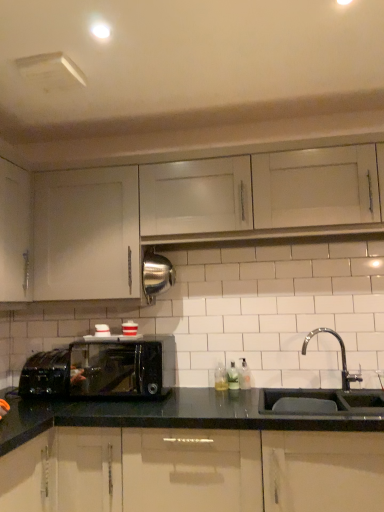
Question: Does black matte sink at lower right lie behind clear glass soap dispenser at sink right, which is counted as the third bottle, starting from the left?

Choices:
 (A) no
 (B) yes

Answer: (A)

Question: From a real-world perspective, is black matte sink at lower right physically below clear glass soap dispenser at sink right, which is counted as the first bottle, starting from the right?

Choices:
 (A) no
 (B) yes

Answer: (B)

Question: From a real-world perspective, is black matte sink at lower right over clear glass soap dispenser at sink right, which is counted as the third bottle, starting from the left?

Choices:
 (A) no
 (B) yes

Answer: (A)

Question: From the image's perspective, is black matte sink at lower right located beneath clear glass soap dispenser at sink right, which is counted as the third bottle, starting from the left?

Choices:
 (A) no
 (B) yes

Answer: (A)

Question: Is the surface of black matte sink at lower right in direct contact with clear glass soap dispenser at sink right, which is counted as the first bottle, starting from the right?

Choices:
 (A) no
 (B) yes

Answer: (A)

Question: Considering the relative positions of black matte sink at lower right and clear glass soap dispenser at sink right, which is counted as the third bottle, starting from the left, in the image provided, is black matte sink at lower right to the right of clear glass soap dispenser at sink right, which is counted as the third bottle, starting from the left, from the viewer's perspective?

Choices:
 (A) no
 (B) yes

Answer: (B)

Question: Considering the relative sizes of glossy black cabinets at lower center, arranged as the 1th cabinetry when ordered from the bottom, and clear glass soap dispenser at sink right, which is counted as the third bottle, starting from the left, in the image provided, is glossy black cabinets at lower center, arranged as the 1th cabinetry when ordered from the bottom, smaller than clear glass soap dispenser at sink right, which is counted as the third bottle, starting from the left,?

Choices:
 (A) no
 (B) yes

Answer: (A)

Question: From a real-world perspective, is glossy black cabinets at lower center, positioned as the 3th cabinetry in top-to-bottom order, under clear glass soap dispenser at sink right, which is counted as the third bottle, starting from the left?

Choices:
 (A) no
 (B) yes

Answer: (B)

Question: Is glossy black cabinets at lower center, positioned as the 3th cabinetry in top-to-bottom order, positioned in front of clear glass soap dispenser at sink right, which is counted as the first bottle, starting from the right?

Choices:
 (A) yes
 (B) no

Answer: (A)

Question: Is glossy black cabinets at lower center, arranged as the 1th cabinetry when ordered from the bottom, not within clear glass soap dispenser at sink right, which is counted as the first bottle, starting from the right?

Choices:
 (A) no
 (B) yes

Answer: (B)

Question: Is glossy black cabinets at lower center, arranged as the 1th cabinetry when ordered from the bottom, to the left of clear glass soap dispenser at sink right, which is counted as the first bottle, starting from the right, from the viewer's perspective?

Choices:
 (A) yes
 (B) no

Answer: (A)

Question: From the image's perspective, is glossy black cabinets at lower center, positioned as the 3th cabinetry in top-to-bottom order, under clear glass soap dispenser at sink right, which is counted as the first bottle, starting from the right?

Choices:
 (A) yes
 (B) no

Answer: (A)

Question: Is clear glass soap dispenser at sink right, which is counted as the third bottle, starting from the left, wider than white matte cabinet at upper center, arranged as the 1th cabinetry when viewed from the top?

Choices:
 (A) yes
 (B) no

Answer: (B)